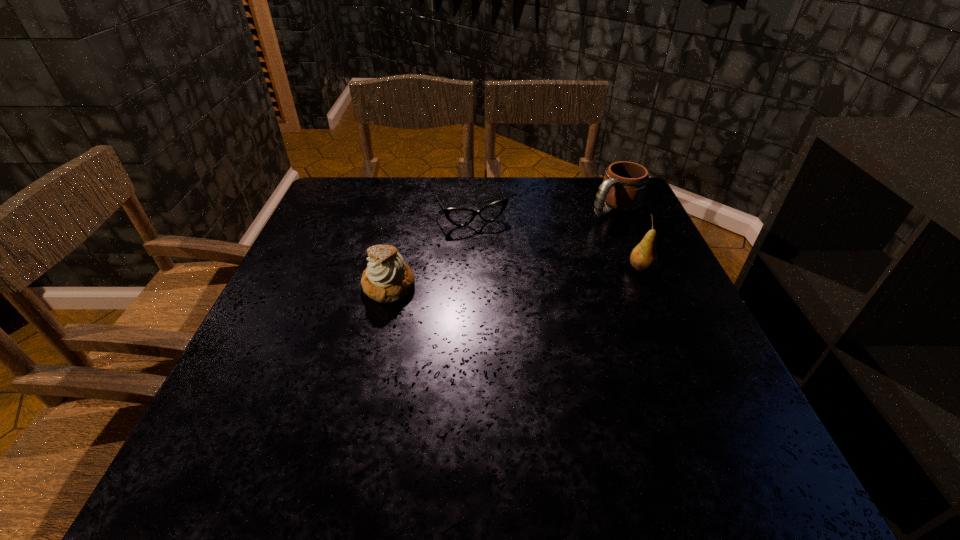
Locate an element on the screen. This screenshot has height=540, width=960. free space on the desktop that is between the pastry and the tallest object and is positioned on the side of the mug with the handle is located at coordinates (505, 278).

Locate an element on the screen. The image size is (960, 540). free space on the desktop that is between the leftmost object and the tallest object and is positioned on the front-facing side of the shortest object is located at coordinates (505, 278).